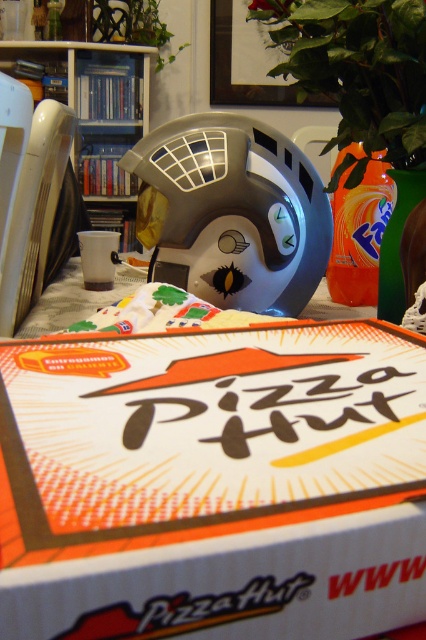
You are standing at the center of the room and want to place a new object on the table. The table has a white tablecloth. Where should you place the new object so it doesn not block the view of the white cardboard pizza hut box at center?

The white cardboard pizza hut box at center is located at point (213, 483). To ensure it remains visible, place the new object away from this coordinate, perhaps to the sides or behind it but not directly in front or overlapping its position.

You are a delivery person who needs to place both the white cardboard pizza hut box at center and the green leafy plant at upper center onto a shelf. The shelf has a height limit of 15 cm. Can you fit both items on the shelf without exceeding the height limit?

The white cardboard pizza hut box at center has a lesser height compared to green leafy plant at upper center. If the green leafy plant at upper center is under 15 cm, then both can fit. However, if the plant exceeds 15 cm, only the pizza box will fit.

You are looking at the table with the Pizza Hut pizza box and two points marked on it. Which point, point (x=264, y=268) or point (x=405, y=76), is closer to you?

Point (x=264, y=268) is closer to you because it is further to the viewer than point (x=405, y=76).